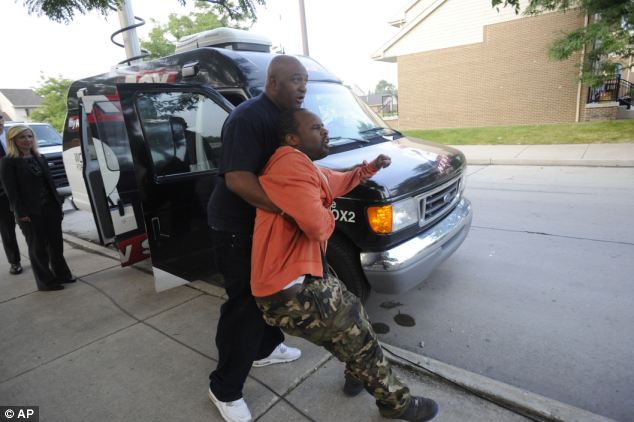
This screenshot has height=422, width=634. What are the coordinates of `door` in the screenshot? It's located at (193, 226), (107, 203).